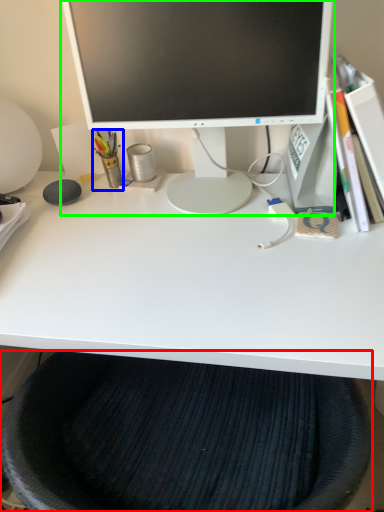
Question: Estimate the real-world distances between objects in this image. Which object is farther from computer chair (highlighted by a red box), stationery (highlighted by a blue box) or computer monitor (highlighted by a green box)?

Choices:
 (A) stationery
 (B) computer monitor

Answer: (A)